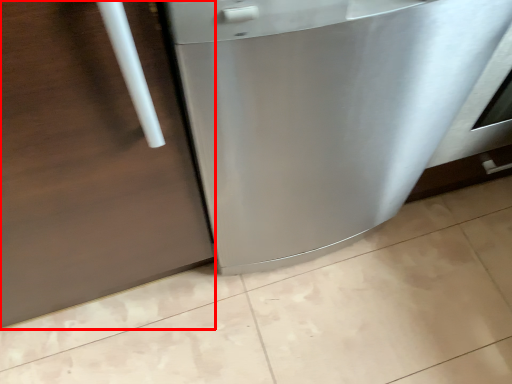
Question: From the image's perspective, where is door (annotated by the red box) located relative to home appliance?

Choices:
 (A) below
 (B) above

Answer: (A)